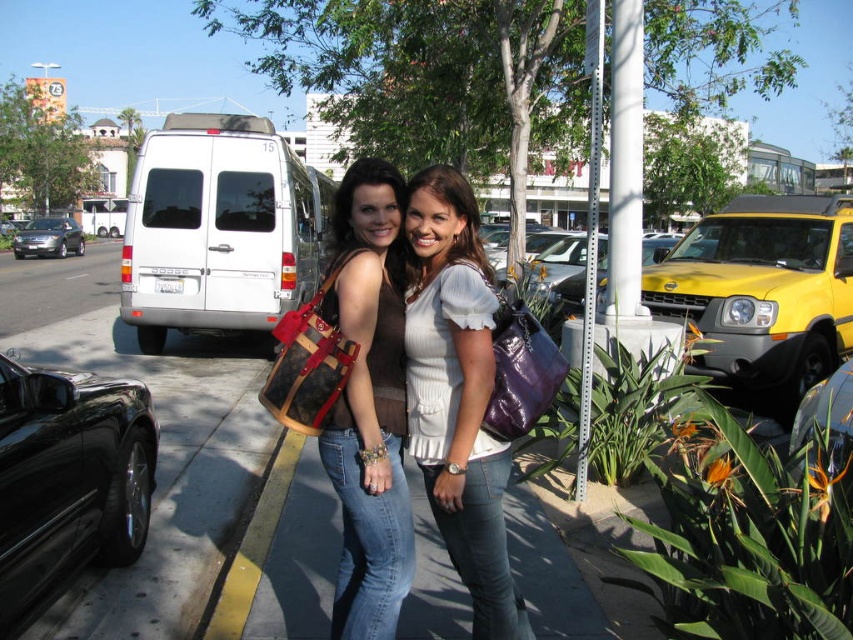
You are a photographer trying to capture a closeup of the brown leather purse at center and the black glossy car at lower left. Which object will appear larger in the photo?

The brown leather purse at center will appear larger in the photo because it is much taller than the black glossy car at lower left.